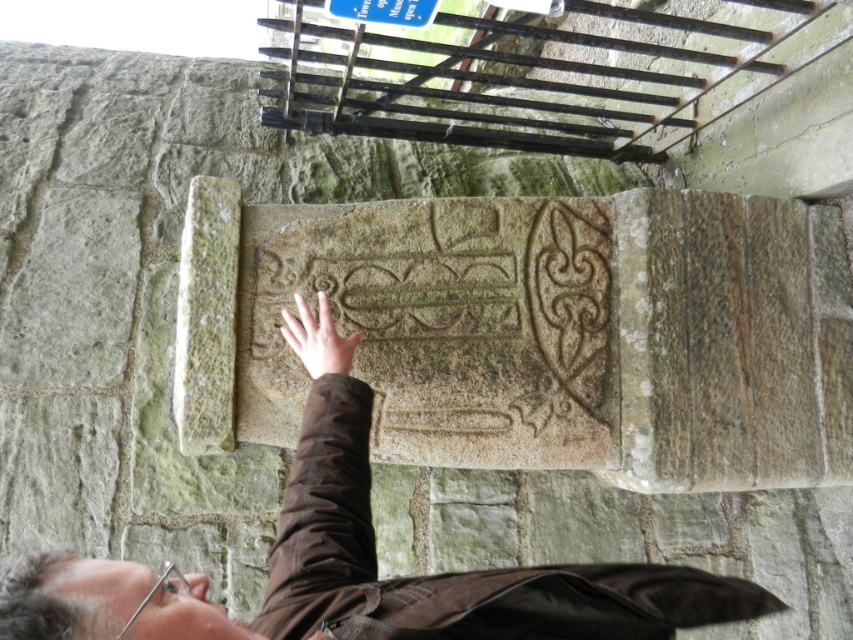
Does smooth skin hand at center have a greater width compared to blue plastic sign at upper center?

In fact, smooth skin hand at center might be narrower than blue plastic sign at upper center.

Looking at this image, between smooth skin hand at center and blue plastic sign at upper center, which one is positioned lower?

smooth skin hand at center

Locate an element on the screen. smooth skin hand at center is located at coordinates click(318, 339).

The height and width of the screenshot is (640, 853). Find the location of `smooth skin hand at center`. smooth skin hand at center is located at coordinates pyautogui.click(x=318, y=339).

Between brown leather jacket at center and blue plastic sign at upper center, which one appears on the right side from the viewer's perspective?

brown leather jacket at center is more to the right.

How distant is brown leather jacket at center from blue plastic sign at upper center?

3.62 feet

Between point (15, 584) and point (384, 22), which one is positioned behind?

The point (384, 22) is more distant.

The width and height of the screenshot is (853, 640). I want to click on brown leather jacket at center, so click(358, 573).

Is brown leather jacket at center to the right of smooth skin hand at center from the viewer's perspective?

Indeed, brown leather jacket at center is positioned on the right side of smooth skin hand at center.

The image size is (853, 640). What are the coordinates of `brown leather jacket at center` in the screenshot? It's located at (358, 573).

Identify the location of brown leather jacket at center. (358, 573).